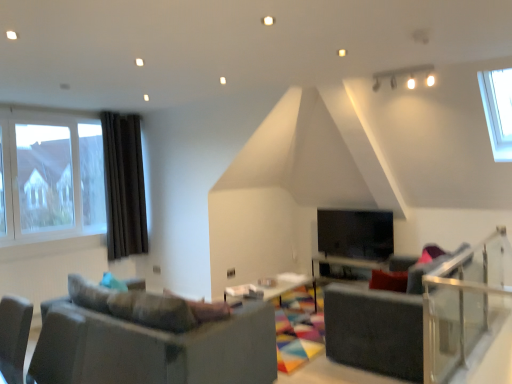
The width and height of the screenshot is (512, 384). Find the location of `matte gray couch at lower left`. matte gray couch at lower left is located at coordinates (155, 349).

What is the approximate width of dark brown fabric curtain at left?

It is 4.52 inches.

Identify the location of wooden table at center, the 1th table when ordered from left to right. The height and width of the screenshot is (384, 512). (274, 287).

In the scene shown: What is the approximate height of dark gray fabric armchair at center?

It is 88.50 centimeters.

Image resolution: width=512 pixels, height=384 pixels. Describe the element at coordinates (379, 325) in the screenshot. I see `dark gray fabric armchair at center` at that location.

The width and height of the screenshot is (512, 384). What do you see at coordinates (50, 177) in the screenshot? I see `clear glass window at left` at bounding box center [50, 177].

Where is `matte gray couch at lower left`? matte gray couch at lower left is located at coordinates (155, 349).

Considering the relative sizes of dark brown fabric curtain at left and clear glass window at left in the image provided, is dark brown fabric curtain at left taller than clear glass window at left?

Yes.

Is dark brown fabric curtain at left next to clear glass window at left and touching it?

No, dark brown fabric curtain at left is not in contact with clear glass window at left.

Can you tell me how much dark brown fabric curtain at left and clear glass window at left differ in facing direction?

The facing directions of dark brown fabric curtain at left and clear glass window at left are 0.355 degrees apart.

Relative to clear glass window at left, is dark brown fabric curtain at left in front or behind?

dark brown fabric curtain at left is behind clear glass window at left.

Can you confirm if wooden table at center, the 1th table positioned from the front, is thinner than dark brown fabric curtain at left?

Incorrect, the width of wooden table at center, the 1th table positioned from the front, is not less than that of dark brown fabric curtain at left.

Considering the points (280, 274) and (125, 198), which point is in front, point (280, 274) or point (125, 198)?

The point (125, 198) is closer to the camera.

Between wooden table at center, which ranks as the second table in back-to-front order, and dark brown fabric curtain at left, which one is positioned in front?

wooden table at center, which ranks as the second table in back-to-front order.

Could you tell me if wooden table at center, the 1th table when ordered from left to right, is turned towards dark brown fabric curtain at left?

No.

From the picture: Is clear glass window at left aimed at black glass fireplace at center?

No.

Locate an element on the screen. window above the black glass fireplace at center (from a real-world perspective) is located at coordinates (50, 177).

In the scene shown: Does clear glass window at left come in front of black glass fireplace at center?

That is True.

How many degrees apart are the facing directions of clear glass window at left and black glass fireplace at center?

There is a 90.6-degree angle between the facing directions of clear glass window at left and black glass fireplace at center.

From the image's perspective, would you say clear glass window at left is positioned over wooden table at center, acting as the first table starting from the right?

Correct, clear glass window at left appears higher than wooden table at center, acting as the first table starting from the right, in the image.

From a real-world perspective, relative to wooden table at center, the first table from the back, is clear glass window at left vertically above or below?

clear glass window at left is situated higher than wooden table at center, the first table from the back, in the real world.

Measure the distance between clear glass window at left and wooden table at center, the first table from the back.

clear glass window at left and wooden table at center, the first table from the back, are 3.39 meters apart.

Looking at this image, in terms of height, does clear glass window at left look taller or shorter compared to wooden table at center, the first table from the back?

Considering their sizes, clear glass window at left has more height than wooden table at center, the first table from the back.

In the image, there is a clear glass window at left. Where is `armchair below it (from the image's perspective)`? armchair below it (from the image's perspective) is located at coordinates (379, 325).

From the image's perspective, would you say dark gray fabric armchair at center is positioned over clear glass window at left?

No, from the image's perspective, dark gray fabric armchair at center is not above clear glass window at left.

Which of these two, dark gray fabric armchair at center or clear glass window at left, is wider?

With larger width is dark gray fabric armchair at center.

Consider the image. Does dark gray fabric armchair at center have a lesser height compared to clear glass window at left?

Yes, dark gray fabric armchair at center is shorter than clear glass window at left.

Is dark gray fabric armchair at center facing away from matte gray couch at lower left?

No, matte gray couch at lower left is not at the back of dark gray fabric armchair at center.

This screenshot has height=384, width=512. In order to click on armchair on the right of the matte gray couch at lower left in this screenshot , I will do `click(379, 325)`.

From the picture: Which is more to the left, dark gray fabric armchair at center or matte gray couch at lower left?

matte gray couch at lower left.

Which of these two, dark gray fabric armchair at center or matte gray couch at lower left, is thinner?

matte gray couch at lower left.

Does wooden table at center, acting as the 2th table starting from the front, have a greater width compared to dark gray fabric armchair at center?

No.

Considering the sizes of objects wooden table at center, acting as the 2th table starting from the front, and dark gray fabric armchair at center in the image provided, who is shorter, wooden table at center, acting as the 2th table starting from the front, or dark gray fabric armchair at center?

Standing shorter between the two is wooden table at center, acting as the 2th table starting from the front.

Is wooden table at center, the second table in the left-to-right sequence, next to dark gray fabric armchair at center?

No, wooden table at center, the second table in the left-to-right sequence, is not touching dark gray fabric armchair at center.

Does wooden table at center, the second table in the left-to-right sequence, have a smaller size compared to dark gray fabric armchair at center?

Yes.

I want to click on window that appears above the dark brown fabric curtain at left (from a real-world perspective), so click(50, 177).

Locate an element on the screen. curtain located on the left of wooden table at center, the 1th table when ordered from left to right is located at coordinates (124, 185).

From the image, which object appears to be farther from dark gray fabric armchair at center, clear glass window at left or black glass fireplace at center?

clear glass window at left lies further to dark gray fabric armchair at center than the other object.

From the image, which object appears to be nearer to dark brown fabric curtain at left, dark gray fabric armchair at center or wooden table at center, which ranks as the second table in back-to-front order?

wooden table at center, which ranks as the second table in back-to-front order, is closer to dark brown fabric curtain at left.

Looking at this image, estimate the real-world distances between objects in this image. Which object is further from wooden table at center, the first table from the back, dark gray fabric armchair at center or matte gray couch at lower left?

The object further to wooden table at center, the first table from the back, is matte gray couch at lower left.

When comparing their distances from matte gray couch at lower left, does dark gray fabric armchair at center or dark brown fabric curtain at left seem closer?

Based on the image, dark gray fabric armchair at center appears to be nearer to matte gray couch at lower left.

Estimate the real-world distances between objects in this image. Which object is further from dark gray fabric armchair at center, wooden table at center, the 1th table positioned from the front, or clear glass balustrade at right?

The object further to dark gray fabric armchair at center is wooden table at center, the 1th table positioned from the front.

From the image, which object appears to be nearer to black glass fireplace at center, clear glass balustrade at right or matte gray couch at lower left?

clear glass balustrade at right lies closer to black glass fireplace at center than the other object.

Estimate the real-world distances between objects in this image. Which object is further from clear glass window at left, dark gray fabric armchair at center or clear glass balustrade at right?

clear glass balustrade at right lies further to clear glass window at left than the other object.

Looking at the image, which one is located further to wooden table at center, the first table from the back, black glass fireplace at center or wooden table at center, the 1th table when ordered from left to right?

wooden table at center, the 1th table when ordered from left to right, lies further to wooden table at center, the first table from the back, than the other object.

The height and width of the screenshot is (384, 512). Find the location of `armchair positioned between matte gray couch at lower left and black glass fireplace at center from near to far`. armchair positioned between matte gray couch at lower left and black glass fireplace at center from near to far is located at coordinates (379, 325).

This screenshot has width=512, height=384. I want to click on fireplace between clear glass window at left and dark gray fabric armchair at center from left to right, so click(x=355, y=234).

This screenshot has width=512, height=384. I want to click on curtain between clear glass window at left and black glass fireplace at center in the horizontal direction, so click(124, 185).

This screenshot has width=512, height=384. Find the location of `window between matte gray couch at lower left and dark brown fabric curtain at left along the z-axis`. window between matte gray couch at lower left and dark brown fabric curtain at left along the z-axis is located at coordinates (50, 177).